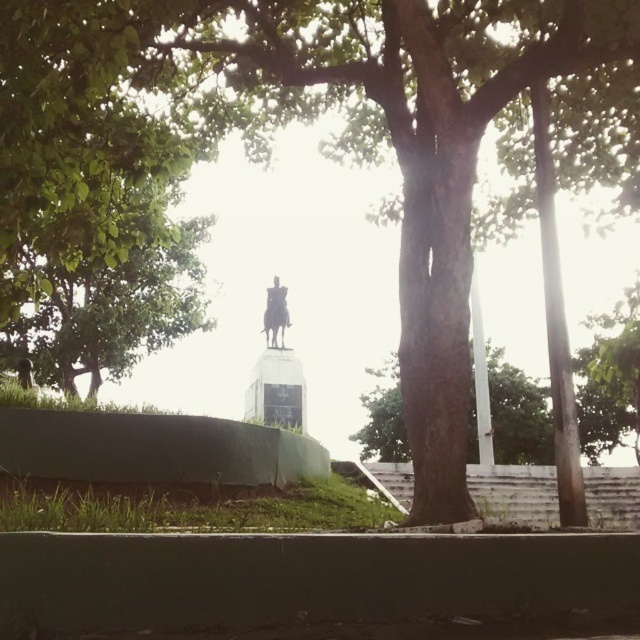
You are an art student trying to sketch the scene. You notice the brown rough tree trunk at center and the metallic statue at center. Which object is positioned lower in the image?

The brown rough tree trunk at center is located below the metallic statue at center, so it is positioned lower in the image.

You are a painter setting up an easel to sketch the scene. You want to ensure that both the brown rough tree trunk at center and the metallic statue at center are clearly visible in your painting. Based on their positions, which object should you place closer to the front of your composition?

The brown rough tree trunk at center should be placed closer to the front of the composition because it is closer to the viewer than the metallic statue at center.

Based on the photo, you are a painter standing at the base of the brown rough tree trunk at center, wanting to paint the metallic statue at center. If your easel is 10 feet wide, can you move it directly between the two objects without it touching either?

The distance between the brown rough tree trunk at center and the metallic statue at center is 19.38 feet. Since the easel is only 10 feet wide, there is enough space between them to place the easel without it touching either object.